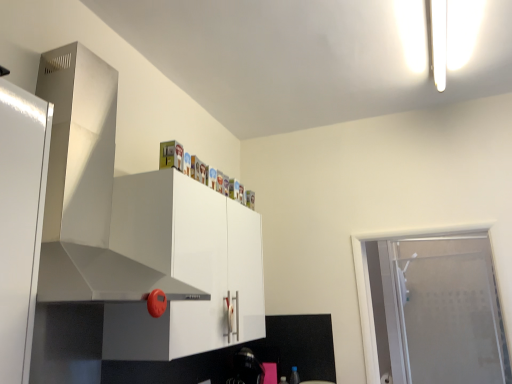
Question: Is point (393, 269) positioned closer to the camera than point (251, 294)?

Choices:
 (A) closer
 (B) farther

Answer: (B)

Question: From their relative heights in the image, would you say frosted glass door at right is taller or shorter than white glossy cabinet at upper center?

Choices:
 (A) short
 (B) tall

Answer: (B)

Question: Considering the real-world distances, which object is farthest from the frosted glass door at right?

Choices:
 (A) stainless steel exhaust hood at upper left
 (B) white glossy cabinet at upper center

Answer: (A)

Question: Based on their relative distances, which object is nearer to the frosted glass door at right?

Choices:
 (A) stainless steel exhaust hood at upper left
 (B) white glossy cabinet at upper center

Answer: (B)